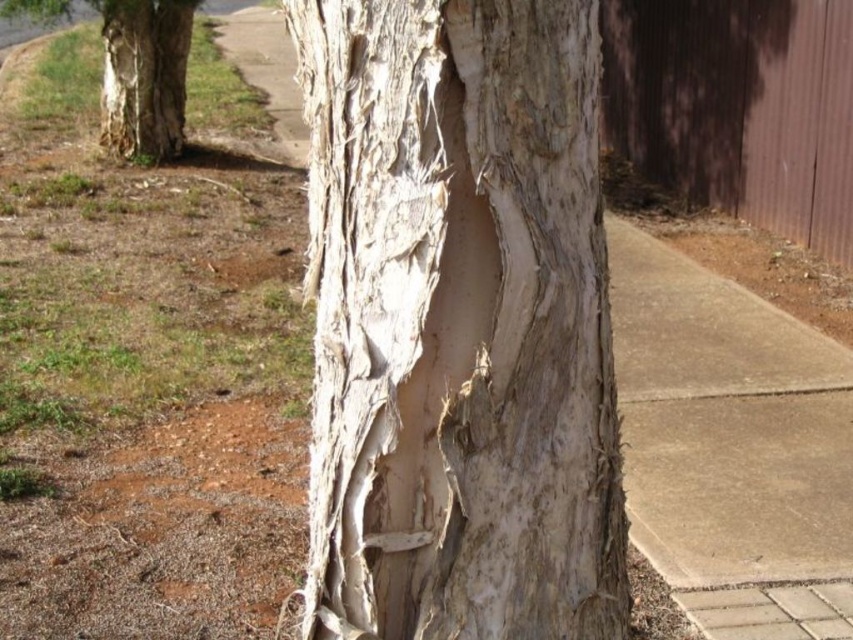
You are a botanist examining the tree trunk. You notice two areas of white textured bark. Which area, the white textured bark at center or the white textured bark at left, is shorter in height?

Answer: The white textured bark at center is not as tall as the white textured bark at left, so the one at center is shorter.

In the scene shown: You are an environmental scientist studying tree bark characteristics. You observe two areas of white textured bark at center and white textured bark at left on the same tree trunk. Which area has a smaller size?

The white textured bark at center has a smaller size compared to the white textured bark at left.

You are standing in front of the tree trunk and want to touch the white textured bark at center and the white textured bark at left. Which one can you reach first without moving your position?

The white textured bark at center is closer to the viewer than the white textured bark at left, so you can reach it first without moving your position.